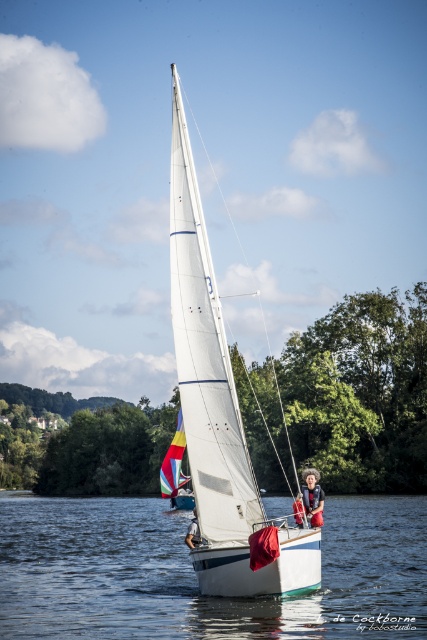
Looking at this image, does white glossy sailboat at center have a lesser width compared to red cotton shirt at center?

In fact, white glossy sailboat at center might be wider than red cotton shirt at center.

Between white glossy sailboat at center and red cotton shirt at center, which one has less height?

red cotton shirt at center

Is point (189, 410) behind point (297, 516)?

No, it is in front of (297, 516).

At what (x,y) coordinates should I click in order to perform the action: click on white glossy sailboat at center. Please return your answer as a coordinate pair (x, y). The height and width of the screenshot is (640, 427). Looking at the image, I should click on (219, 410).

Between white glossy water at center and green leafy tree at center, which one has more height?

green leafy tree at center is taller.

Between white glossy water at center and green leafy tree at center, which one is positioned lower?

white glossy water at center

Is point (379, 618) closer to camera compared to point (411, 388)?

That is True.

This screenshot has width=427, height=640. Identify the location of white glossy water at center. (195, 573).

Can you confirm if white glossy water at center is thinner than smooth skin person at center?

No.

Can you confirm if white glossy water at center is taller than smooth skin person at center?

Yes, white glossy water at center is taller than smooth skin person at center.

The width and height of the screenshot is (427, 640). Describe the element at coordinates (195, 573) in the screenshot. I see `white glossy water at center` at that location.

I want to click on white glossy water at center, so click(x=195, y=573).